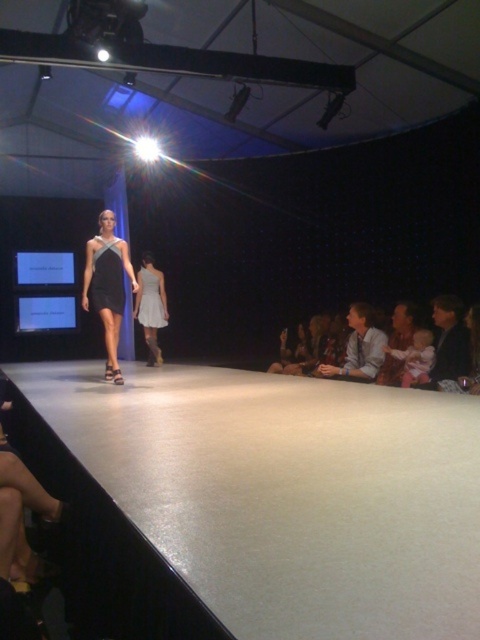
Question: Considering the real-world distances, which object is closest to the light brown leather jacket at lower right?

Choices:
 (A) dark blue fabric at lower right
 (B) light gray fabric dress at center
 (C) satin dress at center
 (D) satin black dress at center

Answer: (A)

Question: Which point is closer to the camera taking this photo?

Choices:
 (A) (464, 348)
 (B) (105, 260)
 (C) (380, 365)
 (D) (148, 358)

Answer: (A)

Question: Does light brown leather jacket at lower right have a larger size compared to satin dress at center?

Choices:
 (A) no
 (B) yes

Answer: (B)

Question: Which point is closer to the camera?

Choices:
 (A) light brown leather jacket at lower right
 (B) dark blue fabric at lower right
 (C) light gray fabric dress at center

Answer: (B)

Question: Is light gray fabric dress at center thinner than black satin dress at center?

Choices:
 (A) no
 (B) yes

Answer: (A)

Question: Can you confirm if light brown leather jacket at lower right is thinner than black satin dress at center?

Choices:
 (A) yes
 (B) no

Answer: (B)